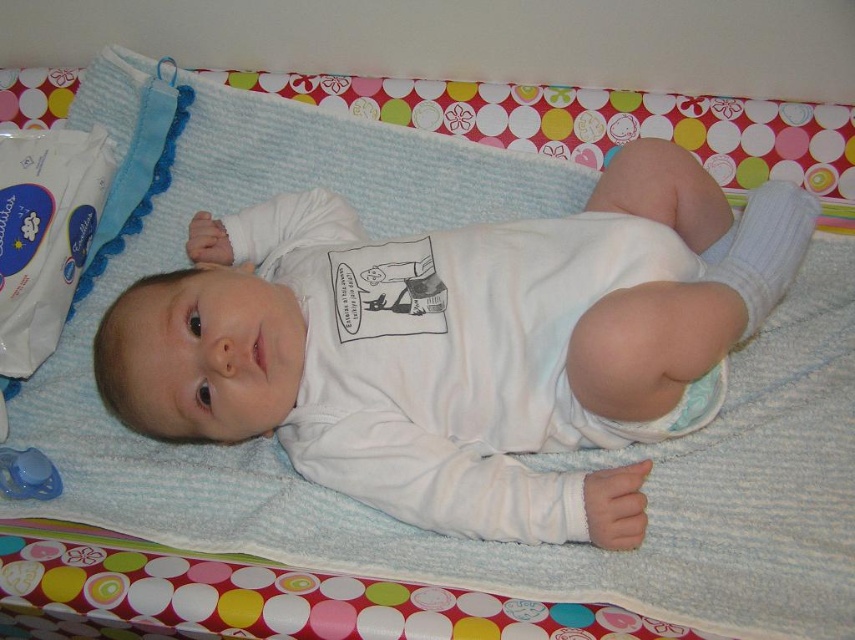
Question: Is white soft baby at center below blue plastic pacifier at lower left?

Choices:
 (A) yes
 (B) no

Answer: (B)

Question: Which point is closer to the camera?

Choices:
 (A) (444, 328)
 (B) (684, 408)
 (C) (52, 486)

Answer: (B)

Question: Considering the real-world distances, which object is closest to the blue plastic pacifier at lower left?

Choices:
 (A) white soft baby at center
 (B) white cloth diaper at center

Answer: (A)

Question: Is white soft baby at center closer to the viewer compared to blue plastic pacifier at lower left?

Choices:
 (A) no
 (B) yes

Answer: (B)

Question: Is white soft baby at center wider than white cloth diaper at center?

Choices:
 (A) yes
 (B) no

Answer: (A)

Question: Which point is closer to the camera taking this photo?

Choices:
 (A) (617, 444)
 (B) (36, 484)
 (C) (257, 220)

Answer: (B)